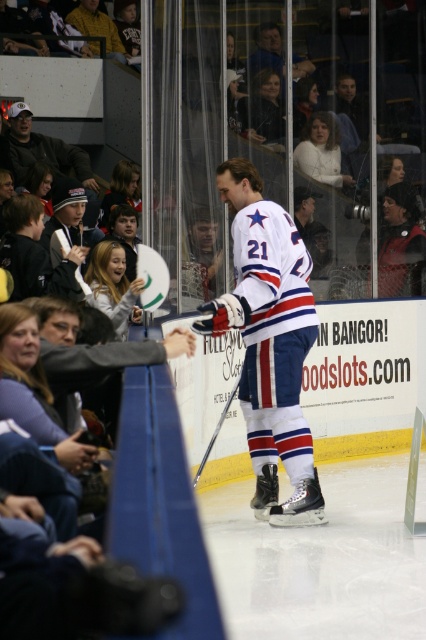
You are a photographer at the hockey game. You want to take a photo of the white jersey at center and the dark gray knit hat at upper left. In the photo, which object should be positioned to the left side?

The dark gray knit hat at upper left should be positioned to the left side because the white jersey at center is to the right of the dark gray knit hat at upper left.

You are a photographer at the hockey game. You want to take a photo that includes both the white jersey at center and the dark gray knit hat at upper left. Which object should you focus on first to ensure both are in frame?

The white jersey at center is taller than the dark gray knit hat at upper left, so you should focus on the white jersey at center first to ensure both are in frame.